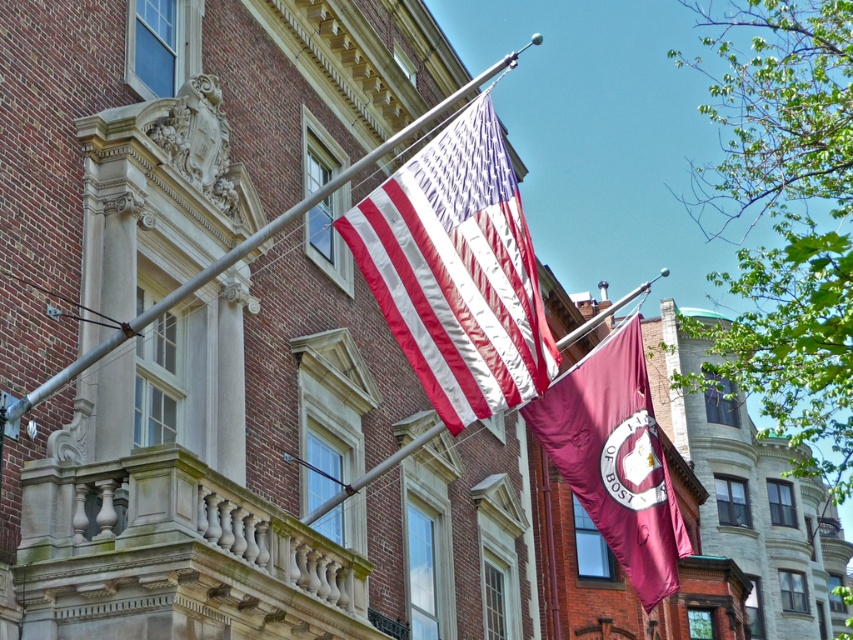
You are standing in front of the brick building and notice the matte fabric flag at center and the metallic pole at upper center. Which object is closer to you?

The matte fabric flag at center is closer to you because the metallic pole at upper center is behind it.

You are a visitor standing in front of the brick building and want to hang a new flag that is 2 meters tall. The maroon fabric flag at center is currently displayed. Can the flagpole, which is the metallic pole at upper center, support a flag of that height?

The maroon fabric flag at center is not as tall as the metallic pole at upper center, so the metallic pole at upper center can support a flag of 2 meters in height.